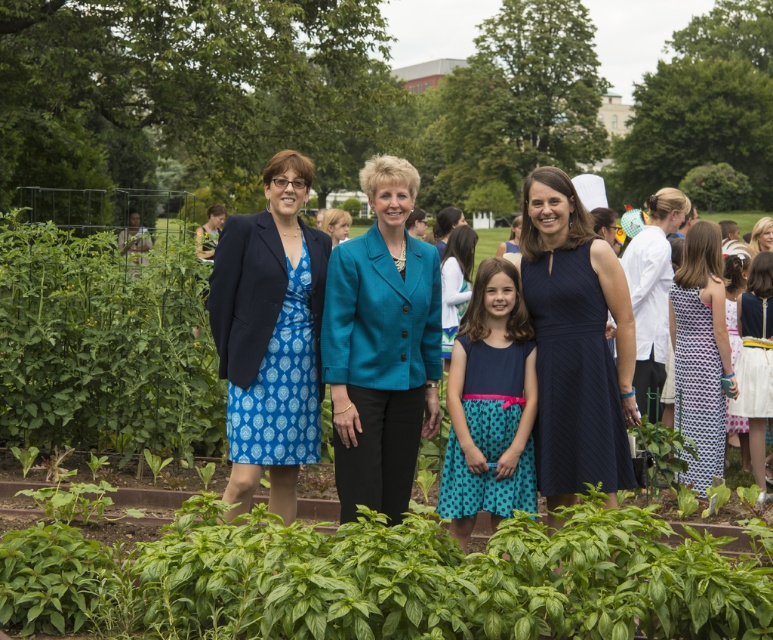
Question: Which point is farther from the camera taking this photo?

Choices:
 (A) (478, 378)
 (B) (404, 300)
 (C) (620, 614)
 (D) (73, 292)

Answer: (D)

Question: Which point is farther to the camera?

Choices:
 (A) (339, 424)
 (B) (523, 420)

Answer: (B)

Question: Observing the image, what is the correct spatial positioning of green leafy plant at left in reference to navy blue dress at center?

Choices:
 (A) below
 (B) above

Answer: (B)

Question: Does green leafy plants at center appear under matte blue dress at center?

Choices:
 (A) no
 (B) yes

Answer: (B)

Question: In this image, where is green leafy plants at center located relative to blue dotted dress at right?

Choices:
 (A) above
 (B) below

Answer: (B)

Question: Estimate the real-world distances between objects in this image. Which object is closer to the green leafy plant at left?

Choices:
 (A) navy blue dress at center
 (B) teal fabric jacket at center
 (C) green leafy plants at center
 (D) white polka dot dress at right

Answer: (B)